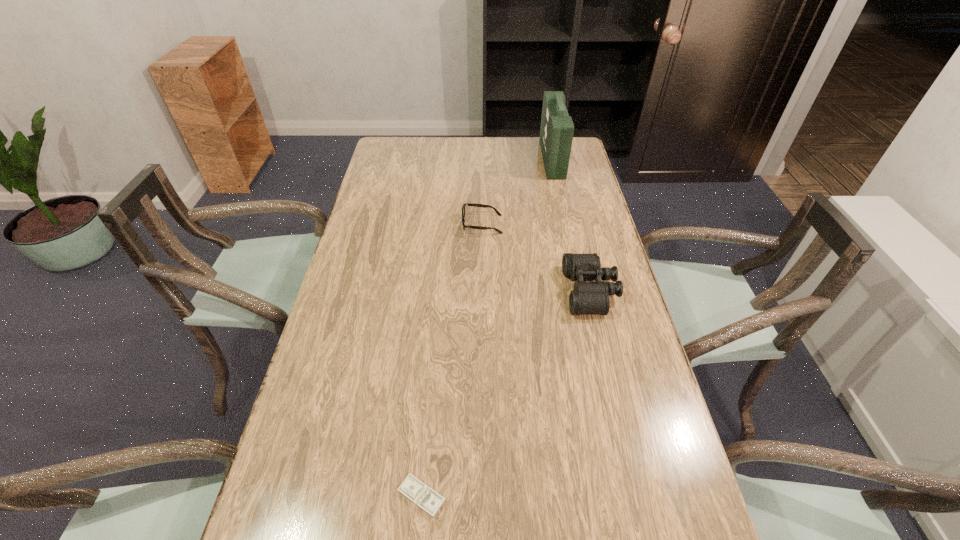
You are a GUI agent. You are given a task and a screenshot of the screen. Output one action in this format:
    pyautogui.click(x=<x>, y=<y>)
    Task: Click on the blank area located 0.210m on the front-facing side of the farthest object
    The height and width of the screenshot is (540, 960).
    Given the screenshot: What is the action you would take?
    pyautogui.click(x=490, y=159)

Locate an element on the screen. The height and width of the screenshot is (540, 960). vacant region located at the eyepieces of the third shortest object is located at coordinates (424, 291).

Where is `free space located 0.320m at the eyepieces of the third shortest object`? The width and height of the screenshot is (960, 540). free space located 0.320m at the eyepieces of the third shortest object is located at coordinates (453, 291).

Where is `vacant space located at the eyepieces of the third shortest object`? This screenshot has width=960, height=540. vacant space located at the eyepieces of the third shortest object is located at coordinates (485, 291).

Image resolution: width=960 pixels, height=540 pixels. I want to click on free space located on the lenses of the third tallest object, so click(356, 225).

Where is `free region located 0.340m on the lenses of the third tallest object`? This screenshot has width=960, height=540. free region located 0.340m on the lenses of the third tallest object is located at coordinates (359, 225).

The height and width of the screenshot is (540, 960). I want to click on free space located 0.090m on the lenses of the third tallest object, so click(435, 225).

Find the location of a particular element. free point located 0.280m on the back of the nearest object is located at coordinates (434, 359).

Locate an element on the screen. This screenshot has width=960, height=540. object that is positioned at the far edge is located at coordinates (556, 132).

Image resolution: width=960 pixels, height=540 pixels. Find the location of `the first-aid kit located in the right edge section of the desktop`. the first-aid kit located in the right edge section of the desktop is located at coordinates (556, 132).